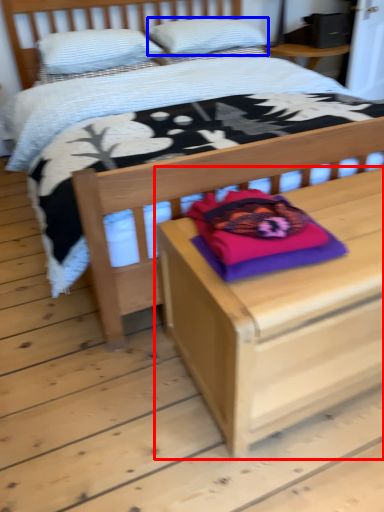
Question: Among these objects, which one is farthest to the camera, nightstand (highlighted by a red box) or pillow (highlighted by a blue box)?

Choices:
 (A) nightstand
 (B) pillow

Answer: (B)